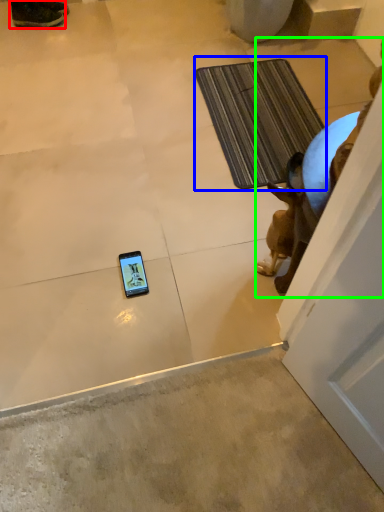
Question: Which is farther away from footwear (highlighted by a red box)? bath mat (highlighted by a blue box) or animal (highlighted by a green box)?

Choices:
 (A) bath mat
 (B) animal

Answer: (B)